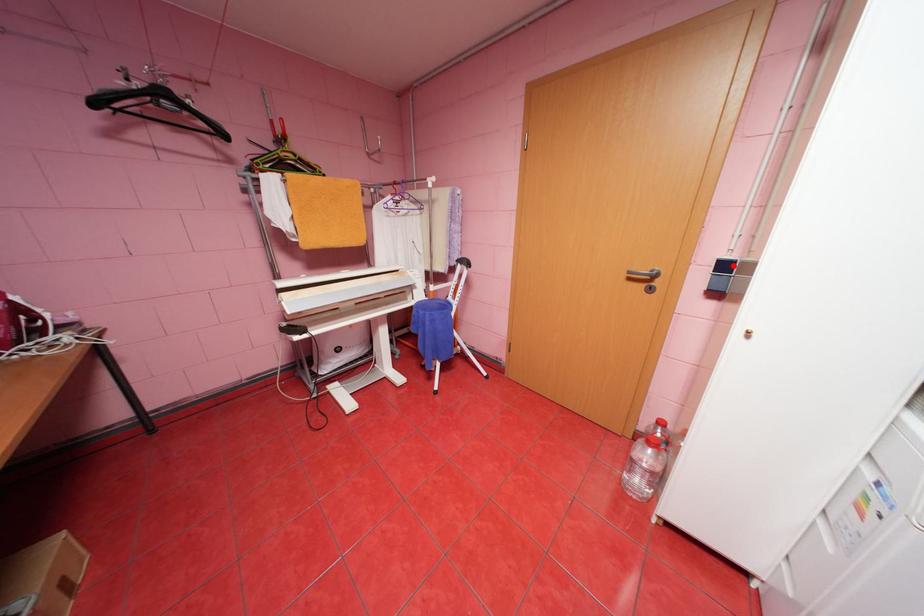
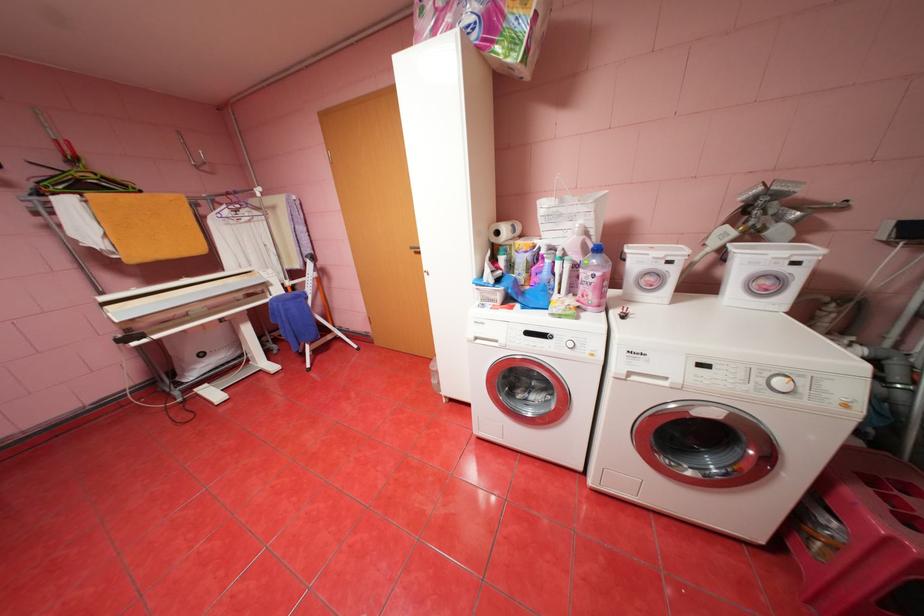
Question: I am providing you with two images of the same scene from different viewpoints. A red point is marked on the first image. Can you still see the location of the red point in image 2?

Choices:
 (A) Yes
 (B) No

Answer: (B)